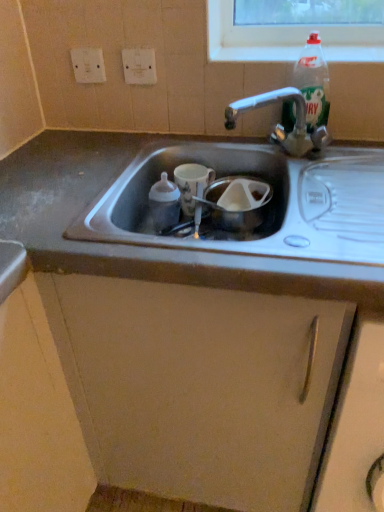
Question: Should I look upward or downward to see clear plastic bottle at upper right, which ranks as the second bottle in bottom-to-top order?

Choices:
 (A) down
 (B) up

Answer: (B)

Question: Considering the relative sizes of metallic gray cabinet at center and white glossy cup at center in the image provided, is metallic gray cabinet at center smaller than white glossy cup at center?

Choices:
 (A) yes
 (B) no

Answer: (B)

Question: Are metallic gray cabinet at center and white glossy cup at center making contact?

Choices:
 (A) no
 (B) yes

Answer: (A)

Question: Is metallic gray cabinet at center shorter than white glossy cup at center?

Choices:
 (A) no
 (B) yes

Answer: (A)

Question: Are metallic gray cabinet at center and white glossy cup at center located far from each other?

Choices:
 (A) no
 (B) yes

Answer: (A)

Question: Can you confirm if metallic gray cabinet at center is positioned to the right of white glossy cup at center?

Choices:
 (A) no
 (B) yes

Answer: (A)

Question: Does metallic gray cabinet at center come behind white glossy cup at center?

Choices:
 (A) yes
 (B) no

Answer: (B)

Question: Is metallic gray cabinet at center positioned with its back to white plastic electric outlet at upper left, the 2th electric outlet positioned from the right?

Choices:
 (A) yes
 (B) no

Answer: (B)

Question: Can you confirm if metallic gray cabinet at center is wider than white plastic electric outlet at upper left, the 2th electric outlet positioned from the right?

Choices:
 (A) yes
 (B) no

Answer: (A)

Question: Considering the relative sizes of metallic gray cabinet at center and white plastic electric outlet at upper left, placed as the 1th electric outlet when sorted from left to right, in the image provided, is metallic gray cabinet at center thinner than white plastic electric outlet at upper left, placed as the 1th electric outlet when sorted from left to right,?

Choices:
 (A) yes
 (B) no

Answer: (B)

Question: Does metallic gray cabinet at center have a greater height compared to white plastic electric outlet at upper left, the 2th electric outlet positioned from the right?

Choices:
 (A) no
 (B) yes

Answer: (B)

Question: Is metallic gray cabinet at center not near white plastic electric outlet at upper left, placed as the 1th electric outlet when sorted from left to right?

Choices:
 (A) yes
 (B) no

Answer: (B)

Question: Is metallic gray cabinet at center with white plastic electric outlet at upper left, placed as the 1th electric outlet when sorted from left to right?

Choices:
 (A) no
 (B) yes

Answer: (A)

Question: From the image's perspective, is white plastic electric outlet at upper center, the second electric outlet viewed from the left, over white glossy cup at center?

Choices:
 (A) no
 (B) yes

Answer: (B)